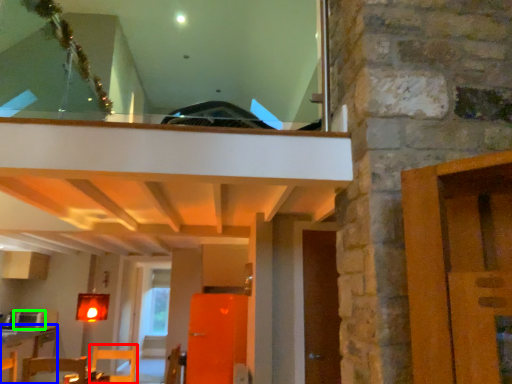
Question: Estimate the real-world distances between objects in this image. Which object is closer to furniture (highlighted by a red box), table (highlighted by a blue box) or appliance (highlighted by a green box)?

Choices:
 (A) table
 (B) appliance

Answer: (A)